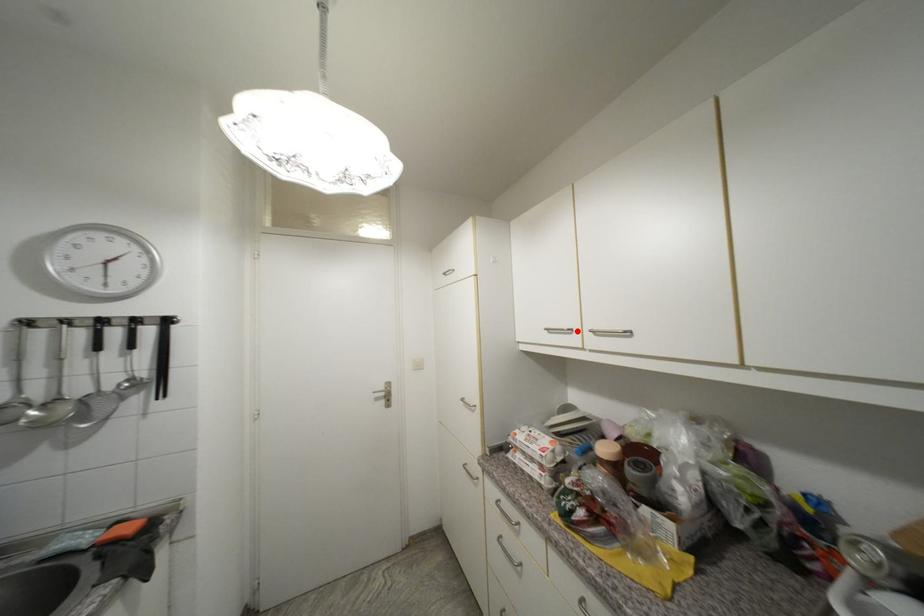
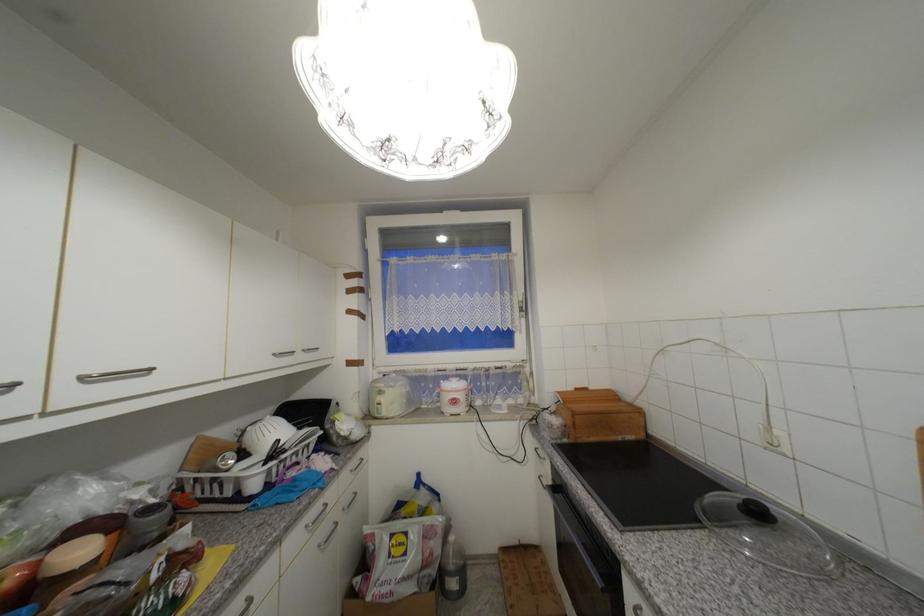
The point at the highlighted location is marked in the first image. Where is the corresponding point in the second image?

(19, 386)